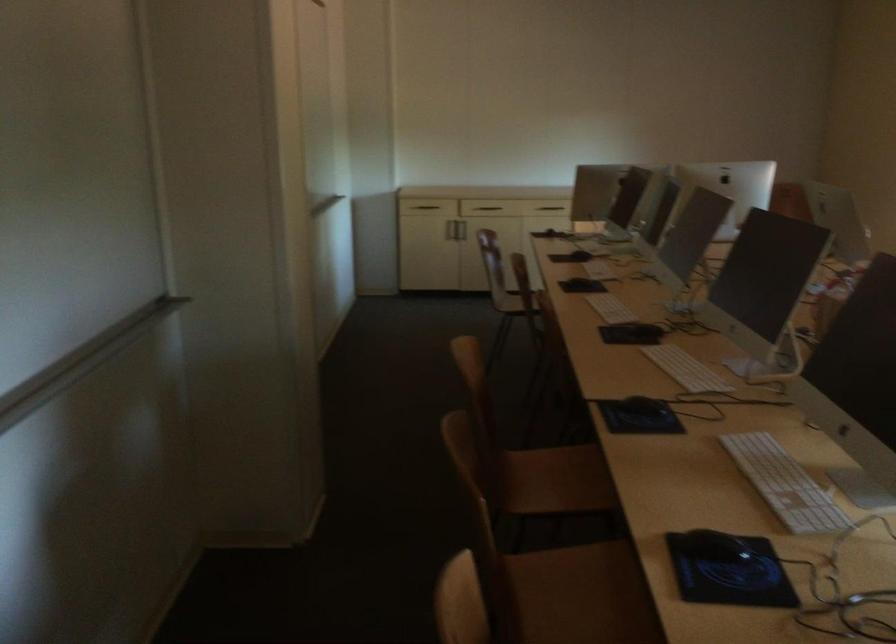
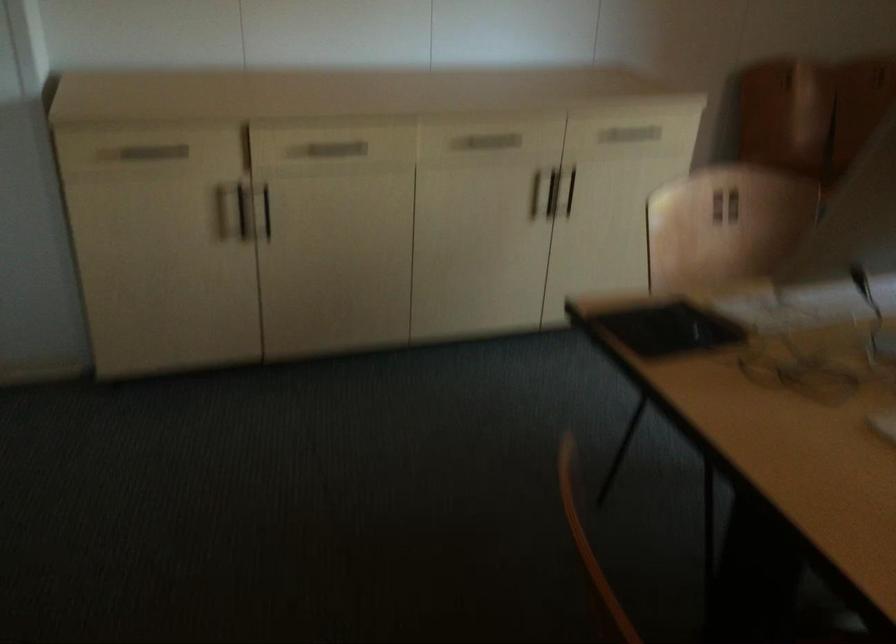
Question: I am providing you with two images of the same scene from different viewpoints. After the viewpoint changes to image2, which objects are now occluded?

Choices:
 (A) black tablet
 (B) silver water kettle
 (C) metal cabinet handle
 (D) vertical cabinet handle

Answer: (C)